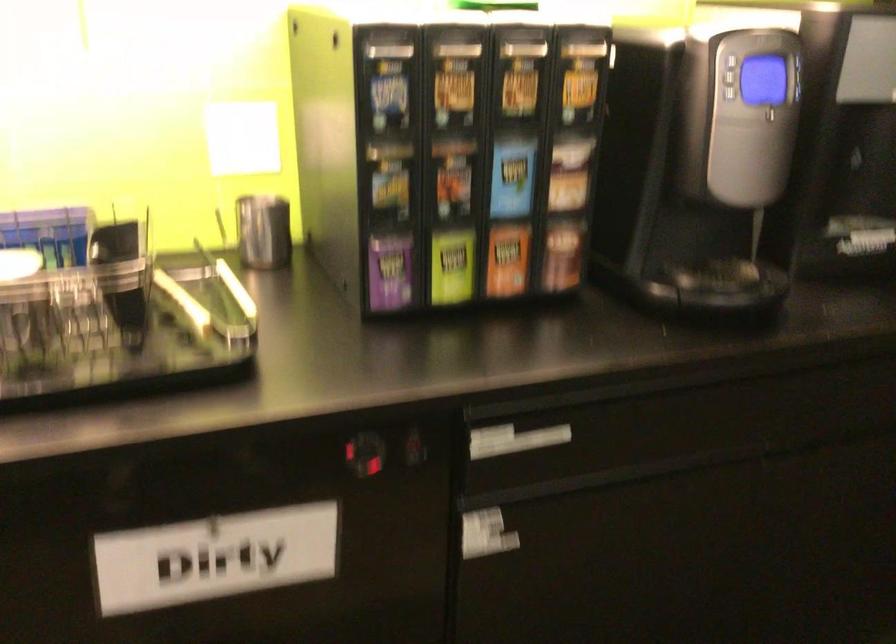
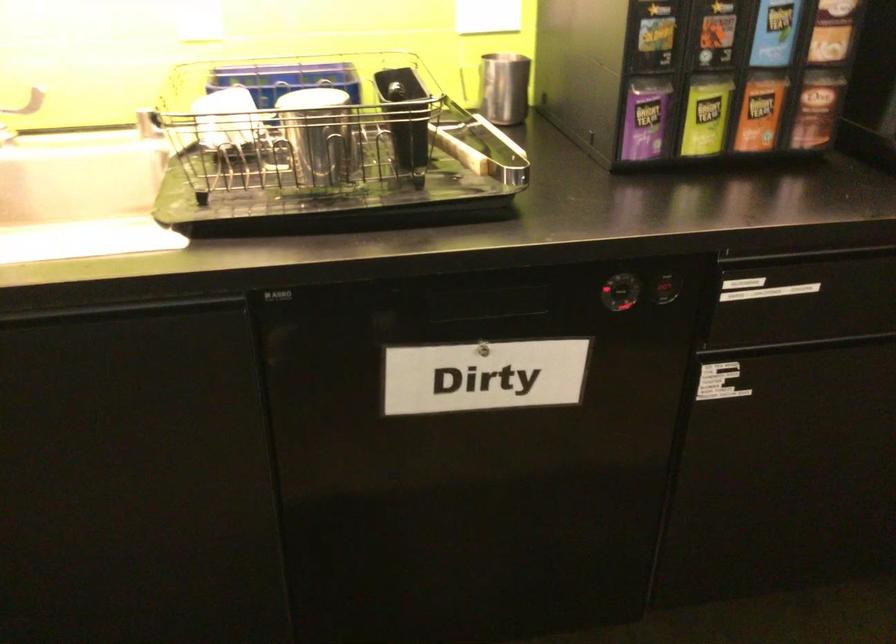
Locate, in the second image, the point that corresponds to (x=451, y=263) in the first image.

(705, 116)